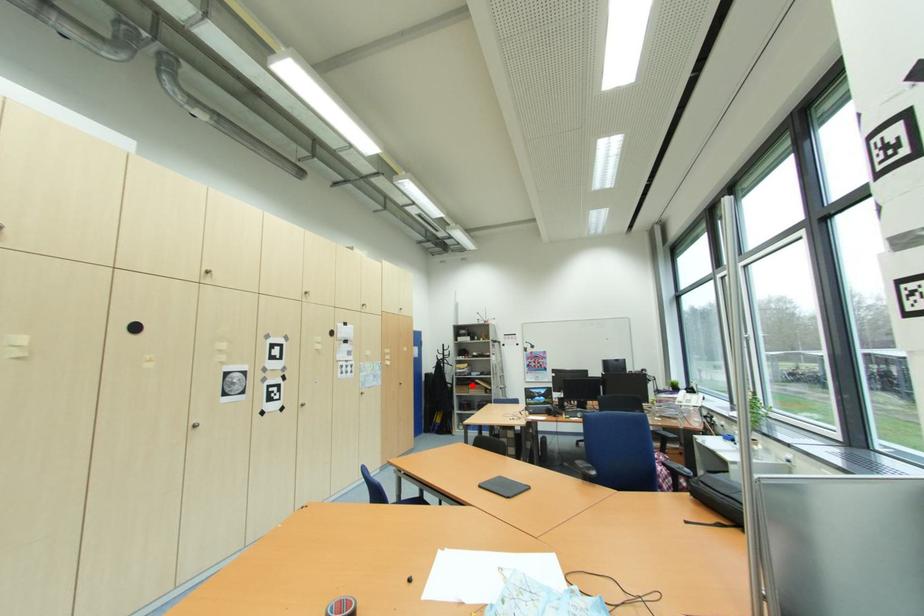
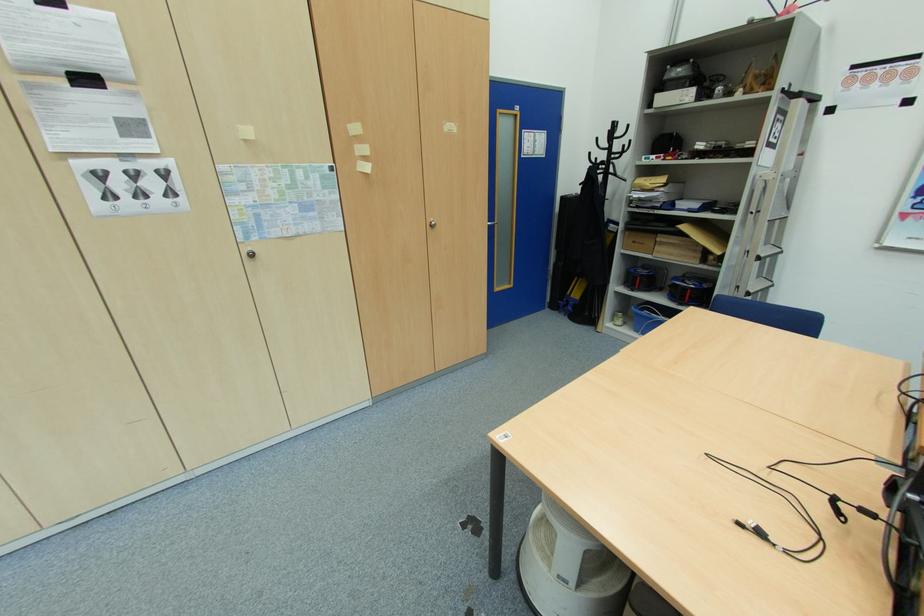
In the second image, find the point that corresponds to the highlighted location in the first image.

(660, 233)